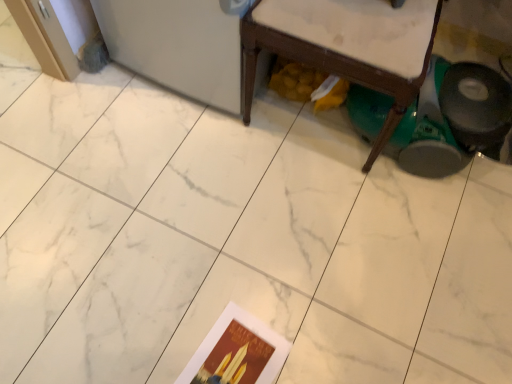
Question: Does wooden chair at lower right have a greater height compared to matte paper postcard at lower center?

Choices:
 (A) no
 (B) yes

Answer: (B)

Question: Considering the relative positions of wooden chair at lower right and matte paper postcard at lower center in the image provided, is wooden chair at lower right behind matte paper postcard at lower center?

Choices:
 (A) no
 (B) yes

Answer: (A)

Question: Does wooden chair at lower right have a lesser width compared to matte paper postcard at lower center?

Choices:
 (A) yes
 (B) no

Answer: (B)

Question: Can you confirm if wooden chair at lower right is shorter than matte paper postcard at lower center?

Choices:
 (A) yes
 (B) no

Answer: (B)

Question: Considering the relative sizes of wooden chair at lower right and matte paper postcard at lower center in the image provided, is wooden chair at lower right bigger than matte paper postcard at lower center?

Choices:
 (A) no
 (B) yes

Answer: (B)

Question: Is wooden chair at lower right oriented away from matte paper postcard at lower center?

Choices:
 (A) no
 (B) yes

Answer: (A)

Question: Is matte paper postcard at lower center further to camera compared to wooden chair at lower right?

Choices:
 (A) yes
 (B) no

Answer: (A)

Question: Is matte paper postcard at lower center at the right side of wooden chair at lower right?

Choices:
 (A) no
 (B) yes

Answer: (A)

Question: Is matte paper postcard at lower center bigger than wooden chair at lower right?

Choices:
 (A) no
 (B) yes

Answer: (A)

Question: Is matte paper postcard at lower center thinner than wooden chair at lower right?

Choices:
 (A) yes
 (B) no

Answer: (A)

Question: Would you say matte paper postcard at lower center is a long distance from wooden chair at lower right?

Choices:
 (A) no
 (B) yes

Answer: (A)

Question: Can you confirm if matte paper postcard at lower center is wider than wooden chair at lower right?

Choices:
 (A) no
 (B) yes

Answer: (A)

Question: Considering their positions, is matte paper postcard at lower center located in front of or behind wooden chair at lower right?

Choices:
 (A) behind
 (B) front

Answer: (A)